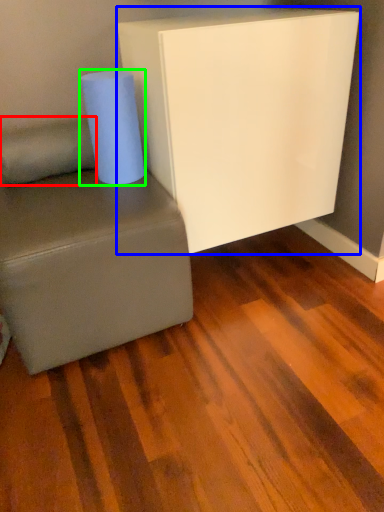
Question: Based on their relative distances, which object is farther from pillow (highlighted by a red box)? Choose from furniture (highlighted by a blue box) and paper towel (highlighted by a green box).

Choices:
 (A) furniture
 (B) paper towel

Answer: (A)